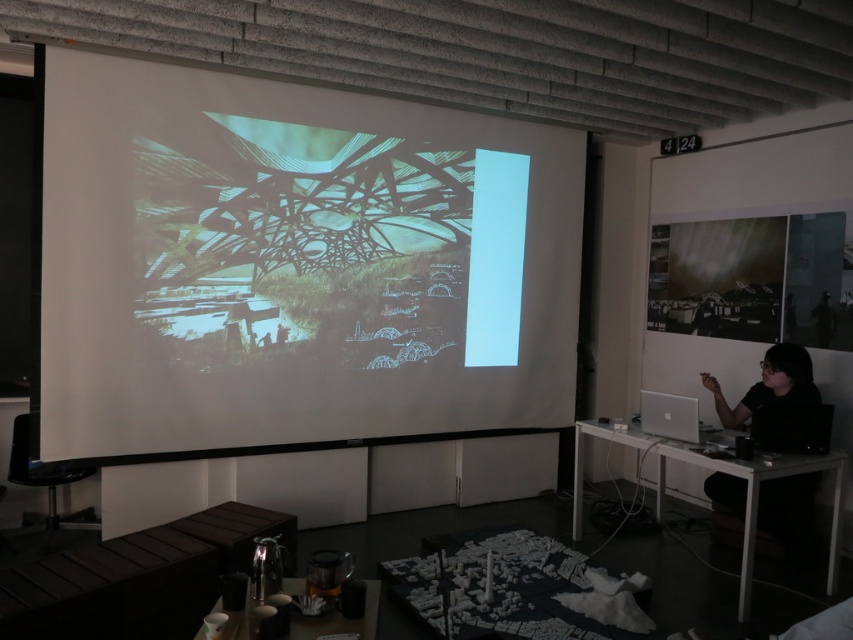
Question: Which point is closer to the camera taking this photo?

Choices:
 (A) (409, 346)
 (B) (770, 378)

Answer: (B)

Question: Is white matte projection screen at center closer to the viewer compared to black matte shirt at right?

Choices:
 (A) no
 (B) yes

Answer: (B)

Question: Can you confirm if white matte projection screen at center is smaller than black matte shirt at right?

Choices:
 (A) yes
 (B) no

Answer: (B)

Question: Is white matte projection screen at center wider than black matte shirt at right?

Choices:
 (A) yes
 (B) no

Answer: (A)

Question: Which point is closer to the camera?

Choices:
 (A) black matte shirt at right
 (B) white matte projection screen at center

Answer: (B)